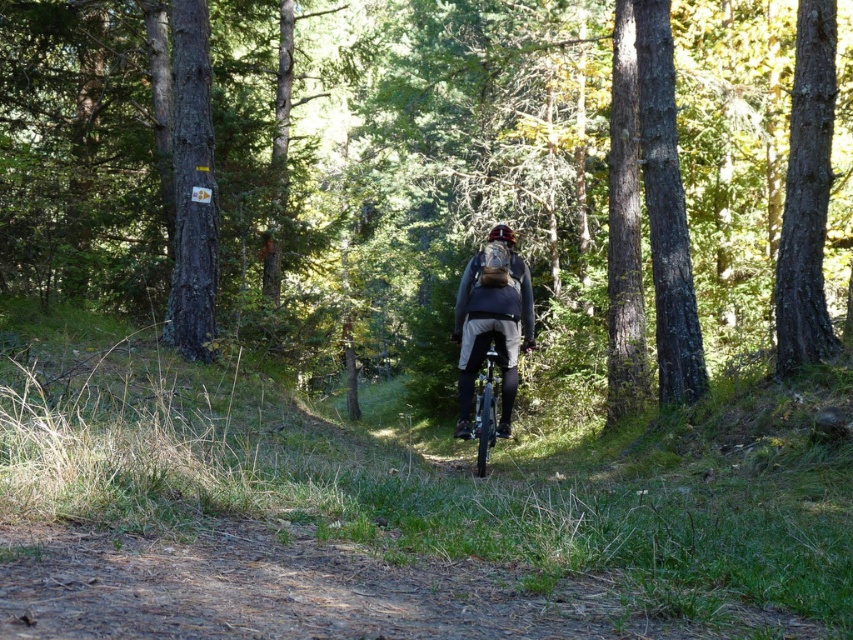
You are a cyclist planning to carry a narrow package that is 10 cm thick. You see the shiny silver bicycle at center and the matte black helmet at center. Which object can the package fit between more easily?

The shiny silver bicycle at center is thinner than the matte black helmet at center, so the narrow package can fit between the shiny silver bicycle at center more easily.

You are a hiker trying to navigate through the forest path. You notice the brown rough bark tree at right and the matte gray jacket at center. Which object is positioned higher from the ground?

The brown rough bark tree at right is located above the matte gray jacket at center, so it is positioned higher from the ground.

You are a hiker who wants to place a marker at point (805,195) on the image. According to the scene, where exactly should you place the marker?

The point (805,195) is on the brown rough bark tree at right, so you should place the marker there.